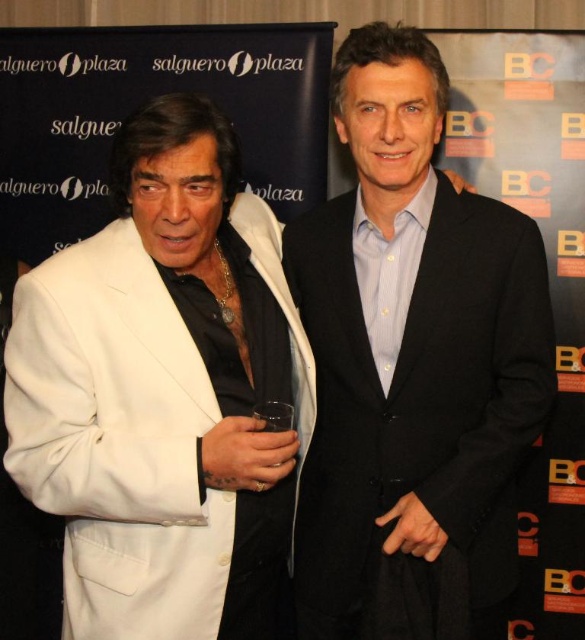
Is black matte suit at center closer to camera compared to white matte suit at left?

No, black matte suit at center is behind white matte suit at left.

Which is below, black matte suit at center or white matte suit at left?

white matte suit at left is lower down.

Is point (316, 538) positioned in front of point (156, 461)?

No, (316, 538) is behind (156, 461).

Find the location of `black matte suit at center`. black matte suit at center is located at coordinates (412, 353).